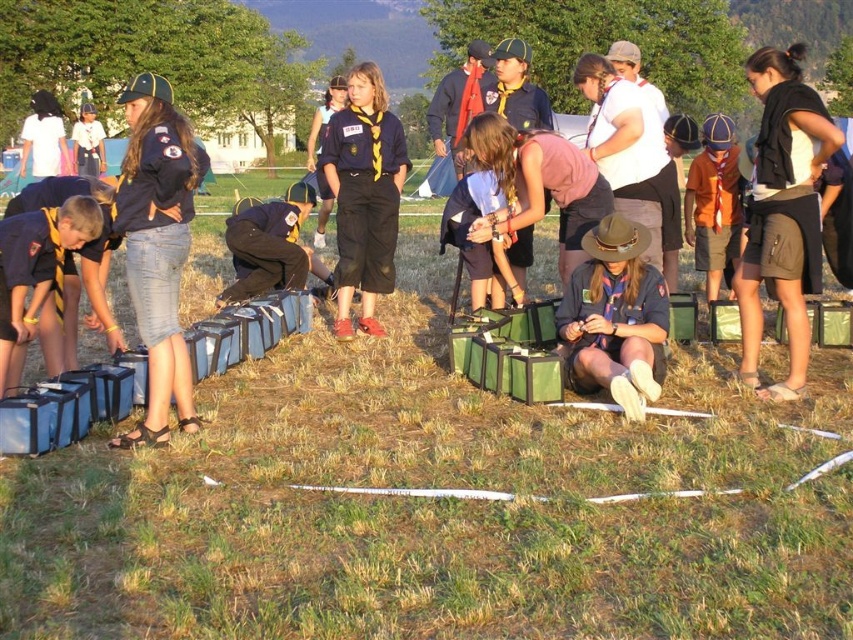
You are a scout leader observing the group. You notice the green grass at center and the matte blue uniform at center. From your viewpoint, which object is positioned to the right of the other?

The green grass at center is to the right of the matte blue uniform at center.

Based on the scene description, where is the green grass at center located in terms of coordinates?

The green grass at center is located at coordinates point (434,506).

You are a scout leader observing the group. You notice the green grass at center and the matte blue uniform at center. Which object is nearer to you?

The green grass at center is closer to the viewer than the matte blue uniform at center.